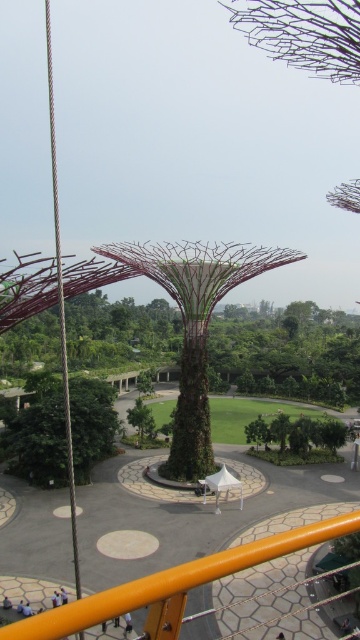
Does green textured tree at lower left have a greater height compared to green textured tree at center?

Indeed, green textured tree at lower left has a greater height compared to green textured tree at center.

Which is more to the left, green textured tree at lower left or green textured tree at center?

green textured tree at lower left

Does point (74, 404) come farther from viewer compared to point (140, 424)?

No, it is in front of (140, 424).

Find the location of `green textured tree at lower left`. green textured tree at lower left is located at coordinates (39, 442).

Is point (255, 403) closer to viewer compared to point (138, 404)?

No, it is behind (138, 404).

Does green grassy field at center have a lesser height compared to green textured tree at center?

Yes, green grassy field at center is shorter than green textured tree at center.

Looking at this image, who is more distant from viewer, (x=213, y=429) or (x=137, y=408)?

The point (x=213, y=429) is more distant.

The width and height of the screenshot is (360, 640). Identify the location of green grassy field at center. (249, 417).

Is green textured tree at lower left in front of green grassy field at center?

That is True.

Who is shorter, green textured tree at lower left or green grassy field at center?

With less height is green grassy field at center.

Between point (54, 438) and point (168, 420), which one is positioned behind?

The point (168, 420) is behind.

This screenshot has height=640, width=360. What are the coordinates of `green textured tree at lower left` in the screenshot? It's located at (39, 442).